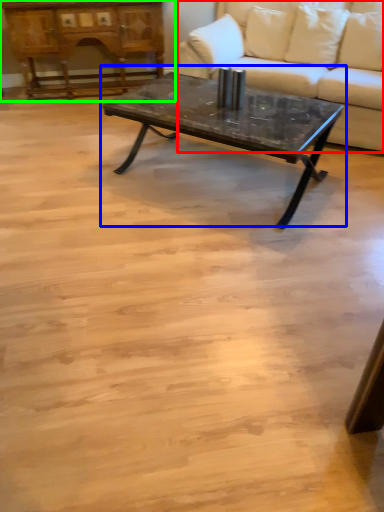
Question: Considering the real-world distances, which object is farthest from studio couch (highlighted by a red box)? coffee table (highlighted by a blue box) or dresser (highlighted by a green box)?

Choices:
 (A) coffee table
 (B) dresser

Answer: (B)